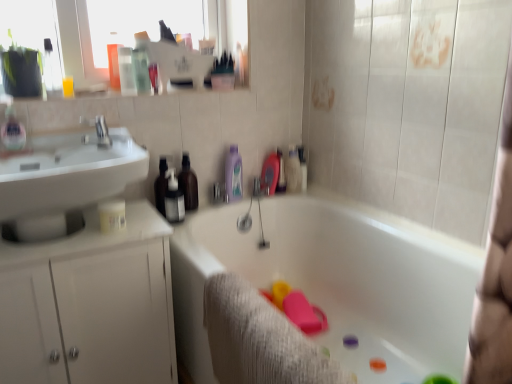
Question: Is white glossy bathtub at center at the right side of white glossy cabinet at left?

Choices:
 (A) no
 (B) yes

Answer: (B)

Question: From a real-world perspective, is white glossy bathtub at center physically below white glossy cabinet at left?

Choices:
 (A) no
 (B) yes

Answer: (B)

Question: From the image's perspective, is white glossy bathtub at center above white glossy cabinet at left?

Choices:
 (A) no
 (B) yes

Answer: (A)

Question: Can you confirm if white glossy bathtub at center is thinner than white glossy cabinet at left?

Choices:
 (A) no
 (B) yes

Answer: (A)

Question: Considering the relative sizes of white glossy bathtub at center and white glossy cabinet at left in the image provided, is white glossy bathtub at center wider than white glossy cabinet at left?

Choices:
 (A) yes
 (B) no

Answer: (A)

Question: From a real-world perspective, relative to white glossy bathtub at center, is white glossy sink at left vertically above or below?

Choices:
 (A) above
 (B) below

Answer: (A)

Question: From the image's perspective, is white glossy sink at left positioned above or below white glossy bathtub at center?

Choices:
 (A) below
 (B) above

Answer: (B)

Question: From their relative heights in the image, would you say white glossy sink at left is taller or shorter than white glossy bathtub at center?

Choices:
 (A) short
 (B) tall

Answer: (A)

Question: Is white glossy sink at left in front of or behind white glossy bathtub at center in the image?

Choices:
 (A) behind
 (B) front

Answer: (A)

Question: Would you say white glossy cabinet at left is inside or outside silver metallic faucet at upper left?

Choices:
 (A) inside
 (B) outside

Answer: (B)

Question: Is white glossy cabinet at left wider or thinner than silver metallic faucet at upper left?

Choices:
 (A) thin
 (B) wide

Answer: (B)

Question: From a real-world perspective, is white glossy cabinet at left above or below silver metallic faucet at upper left?

Choices:
 (A) below
 (B) above

Answer: (A)

Question: From their relative heights in the image, would you say white glossy cabinet at left is taller or shorter than silver metallic faucet at upper left?

Choices:
 (A) tall
 (B) short

Answer: (A)

Question: From the image's perspective, is translucent plastic bottle at center, which ranks as the 2th toiletry in right-to-left order, positioned above or below gray textured bath towel at lower center?

Choices:
 (A) below
 (B) above

Answer: (B)

Question: Looking at the image, does translucent plastic bottle at center, the 2th toiletry in the left-to-right sequence, seem bigger or smaller compared to gray textured bath towel at lower center?

Choices:
 (A) small
 (B) big

Answer: (A)